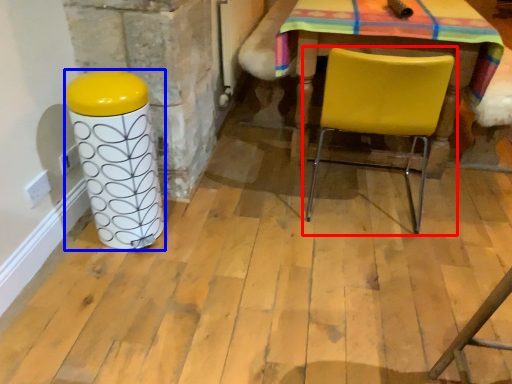
Question: Which object appears closest to the camera in this image, chair (highlighted by a red box) or pillar (highlighted by a blue box)?

Choices:
 (A) chair
 (B) pillar

Answer: (B)